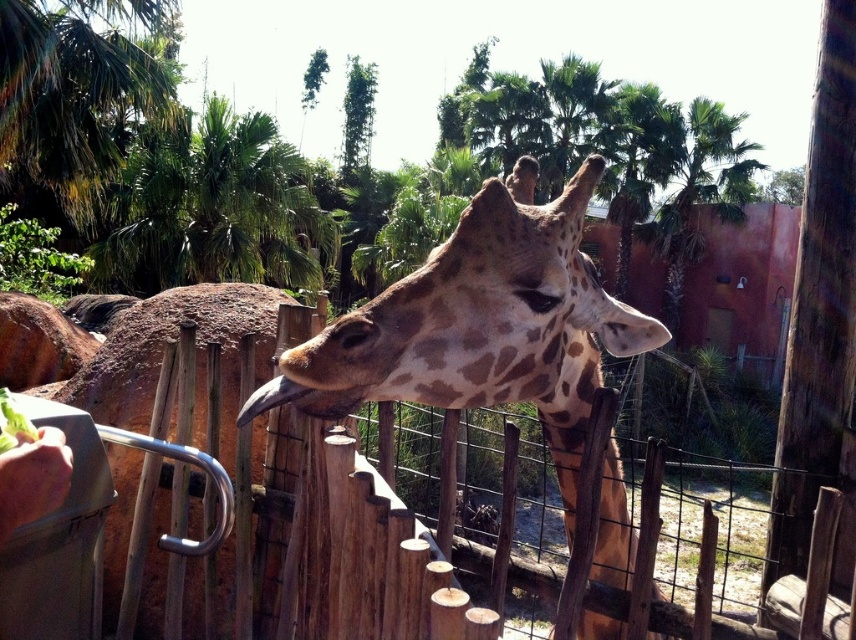
Does spotted brown giraffe at center appear on the left side of green leafy palm tree at upper center?

In fact, spotted brown giraffe at center is to the right of green leafy palm tree at upper center.

Who is positioned more to the left, spotted brown giraffe at center or green leafy palm tree at upper center?

green leafy palm tree at upper center

This screenshot has height=640, width=856. What do you see at coordinates (486, 323) in the screenshot?
I see `spotted brown giraffe at center` at bounding box center [486, 323].

You are a GUI agent. You are given a task and a screenshot of the screen. Output one action in this format:
    pyautogui.click(x=<x>, y=<y>)
    Task: Click on the spotted brown giraffe at center
    Image resolution: width=856 pixels, height=640 pixels.
    Given the screenshot: What is the action you would take?
    pyautogui.click(x=486, y=323)

Who is lower down, green leafy palm tree at upper center or brown matte beak at center?

Positioned lower is brown matte beak at center.

Does green leafy palm tree at upper center have a lesser width compared to brown matte beak at center?

In fact, green leafy palm tree at upper center might be wider than brown matte beak at center.

Describe the element at coordinates (214, 205) in the screenshot. The width and height of the screenshot is (856, 640). I see `green leafy palm tree at upper center` at that location.

Find the location of a particular element. green leafy palm tree at upper center is located at coordinates (214, 205).

Which of these two, spotted brown giraffe at center or brown matte beak at center, stands taller?

spotted brown giraffe at center is taller.

The height and width of the screenshot is (640, 856). Find the location of `spotted brown giraffe at center`. spotted brown giraffe at center is located at coordinates (486, 323).